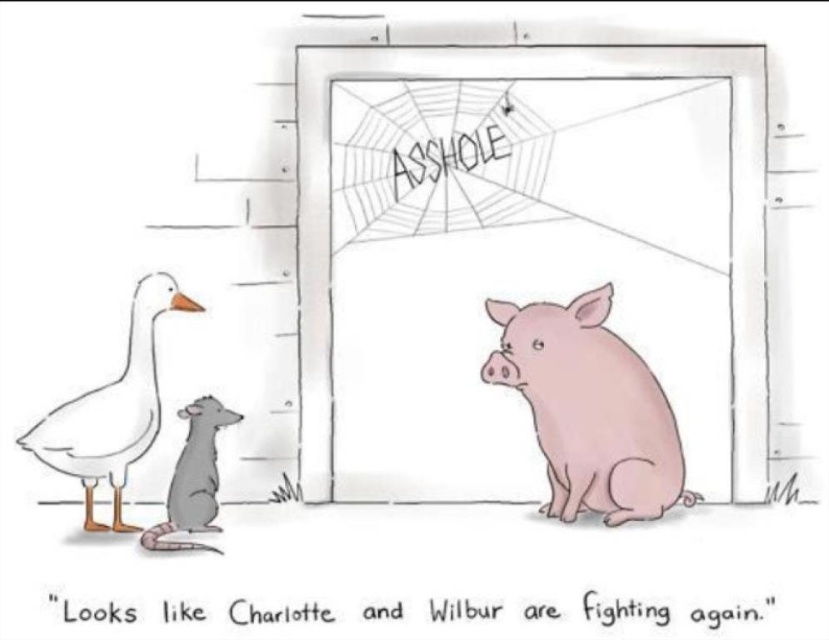
You are a delivery robot that needs to place a package between the pink matte pig at right and the white matte duck at left. The package requires 20 inches of space. Will there be enough space?

The distance between the pink matte pig at right and the white matte duck at left is 22.03 inches, which is more than the required 20 inches. Therefore, there is enough space to place the package between them.